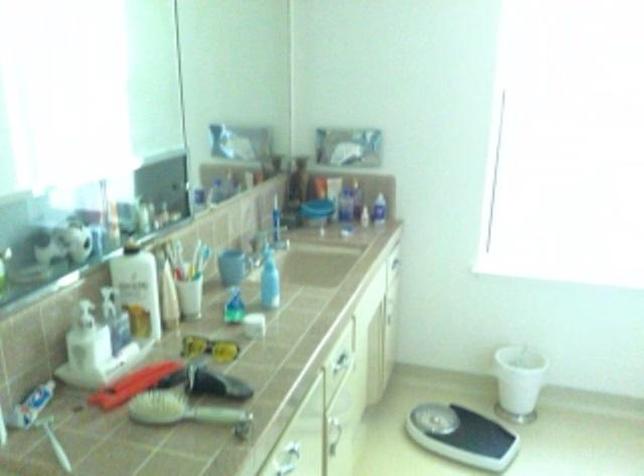
You are a GUI agent. You are given a task and a screenshot of the screen. Output one action in this format:
    pyautogui.click(x=<x>, y=<y>)
    Task: Click on the light colored hairbrush
    The image size is (644, 476).
    Given the screenshot: What is the action you would take?
    pyautogui.click(x=178, y=410)